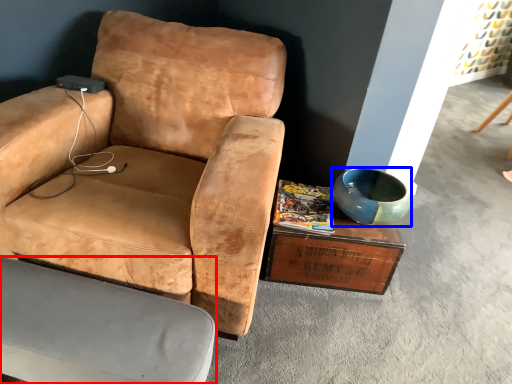
Question: Which object appears farthest to the camera in this image, chair (highlighted by a red box) or bowl (highlighted by a blue box)?

Choices:
 (A) chair
 (B) bowl

Answer: (B)